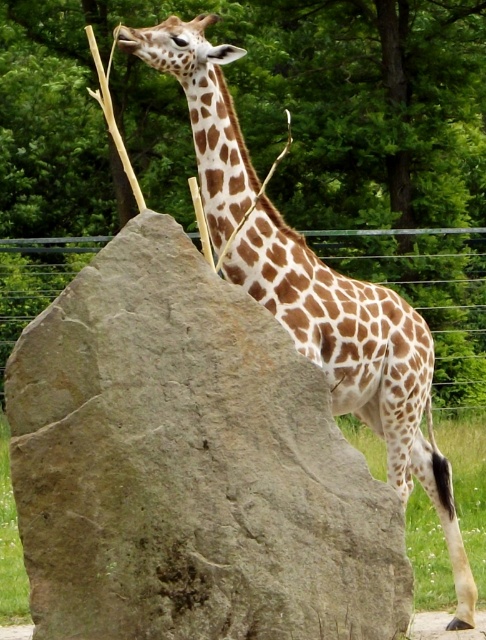
Question: Which object is closer to the camera taking this photo?

Choices:
 (A) gray rough rock at center
 (B) green wire fence at upper center

Answer: (A)

Question: Can you confirm if spotted fur giraffe at center is smaller than green wire fence at upper center?

Choices:
 (A) no
 (B) yes

Answer: (A)

Question: Can you confirm if gray rough rock at center is positioned above spotted fur giraffe at center?

Choices:
 (A) yes
 (B) no

Answer: (B)

Question: Can you confirm if gray rough rock at center is smaller than spotted fur giraffe at center?

Choices:
 (A) no
 (B) yes

Answer: (B)

Question: Which point appears farthest from the camera in this image?

Choices:
 (A) (388, 291)
 (B) (450, 266)
 (C) (262, 492)

Answer: (B)

Question: Among these objects, which one is nearest to the camera?

Choices:
 (A) gray rough rock at center
 (B) spotted fur giraffe at center

Answer: (A)